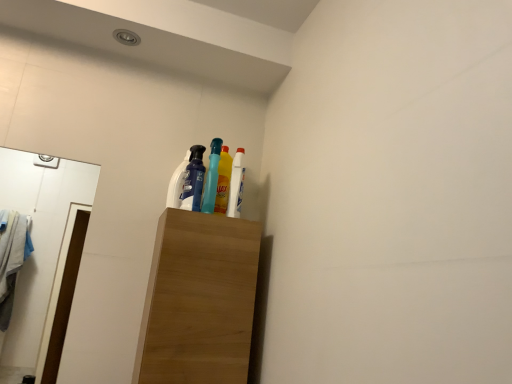
Question: Is white glossy mirror at left positioned beyond the bounds of wooden cabinet at center?

Choices:
 (A) no
 (B) yes

Answer: (B)

Question: Is white glossy mirror at left oriented away from wooden cabinet at center?

Choices:
 (A) no
 (B) yes

Answer: (A)

Question: Is wooden cabinet at center located within white glossy mirror at left?

Choices:
 (A) yes
 (B) no

Answer: (B)

Question: Can you confirm if white glossy mirror at left is taller than wooden cabinet at center?

Choices:
 (A) no
 (B) yes

Answer: (B)

Question: From the image's perspective, is white glossy mirror at left over wooden cabinet at center?

Choices:
 (A) yes
 (B) no

Answer: (A)

Question: In the image, is yellow glossy bottle at upper center, positioned as the 2th bottle in left-to-right order, positioned in front of or behind matte white bottle at upper center, which appears as the 2th cleaning product when viewed from the front?

Choices:
 (A) front
 (B) behind

Answer: (A)

Question: Considering the positions of point (237, 205) and point (174, 205), is point (237, 205) closer or farther from the camera than point (174, 205)?

Choices:
 (A) closer
 (B) farther

Answer: (B)

Question: From the image's perspective, is yellow glossy bottle at upper center, positioned as the 2th bottle in left-to-right order, positioned above or below matte white bottle at upper center, which appears as the 2th cleaning product when viewed from the front?

Choices:
 (A) below
 (B) above

Answer: (A)

Question: Is yellow glossy bottle at upper center, positioned as the 2th bottle in left-to-right order, to the left or to the right of matte white bottle at upper center, marked as the first cleaning product in a back-to-front arrangement, in the image?

Choices:
 (A) left
 (B) right

Answer: (B)

Question: From a real-world perspective, is translucent blue bottle at center, which is counted as the second bottle, starting from the right, physically located above or below yellow glossy bottle at upper center, which is the first bottle in right-to-left order?

Choices:
 (A) below
 (B) above

Answer: (A)

Question: Looking at the image, does translucent blue bottle at center, placed as the first bottle when sorted from left to right, seem bigger or smaller compared to yellow glossy bottle at upper center, which is the first bottle in right-to-left order?

Choices:
 (A) big
 (B) small

Answer: (A)

Question: Considering their positions, is translucent blue bottle at center, placed as the first bottle when sorted from left to right, located in front of or behind yellow glossy bottle at upper center, which is the first bottle in right-to-left order?

Choices:
 (A) front
 (B) behind

Answer: (A)

Question: From the image's perspective, is translucent blue bottle at center, placed as the first bottle when sorted from left to right, located above or below yellow glossy bottle at upper center, positioned as the 2th bottle in left-to-right order?

Choices:
 (A) below
 (B) above

Answer: (B)

Question: From the image's perspective, relative to yellow glossy bottle at upper center, which is the first bottle in right-to-left order, is wooden cabinet at center above or below?

Choices:
 (A) above
 (B) below

Answer: (B)

Question: In terms of width, does wooden cabinet at center look wider or thinner when compared to yellow glossy bottle at upper center, positioned as the 2th bottle in left-to-right order?

Choices:
 (A) thin
 (B) wide

Answer: (B)